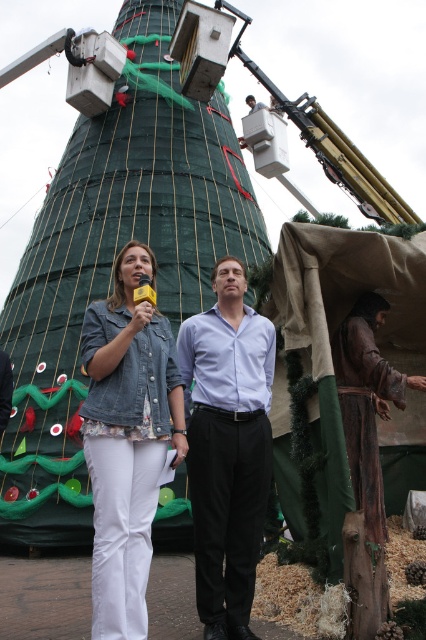
Which is more to the left, green netted tower at center or denim jacket at center?

denim jacket at center

Who is shorter, green netted tower at center or denim jacket at center?

denim jacket at center

The height and width of the screenshot is (640, 426). What do you see at coordinates (112, 260) in the screenshot? I see `green netted tower at center` at bounding box center [112, 260].

This screenshot has width=426, height=640. I want to click on green netted tower at center, so click(x=112, y=260).

In the scene shown: Does denim jacket at center have a greater width compared to light blue shirt at center?

Yes.

Is point (126, 298) closer to camera compared to point (224, 528)?

No, (126, 298) is behind (224, 528).

Does point (112, 467) lie in front of point (244, 490)?

Yes, it is in front of point (244, 490).

Find the location of a particular element. This screenshot has height=640, width=426. denim jacket at center is located at coordinates (126, 440).

Does green netted tower at center lie behind light blue shirt at center?

Yes, it is.

Can you confirm if green netted tower at center is thinner than light blue shirt at center?

In fact, green netted tower at center might be wider than light blue shirt at center.

Describe the element at coordinates (112, 260) in the screenshot. I see `green netted tower at center` at that location.

Locate an element on the screen. green netted tower at center is located at coordinates (112, 260).